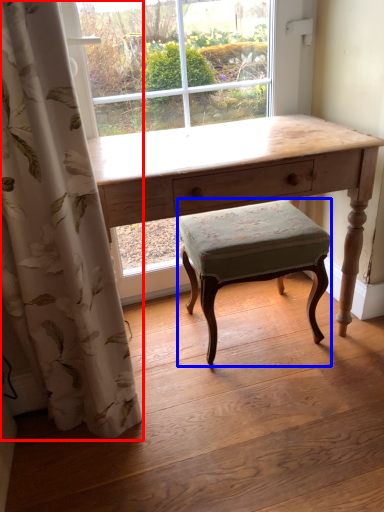
Question: Which object appears closest to the camera in this image, curtain (highlighted by a red box) or stool (highlighted by a blue box)?

Choices:
 (A) curtain
 (B) stool

Answer: (A)